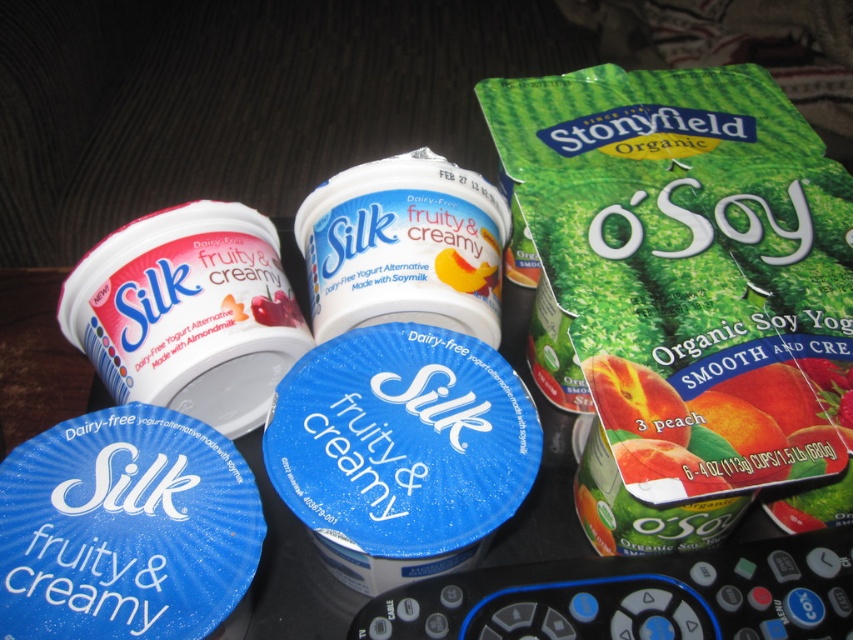
Question: Which point is closer to the camera?

Choices:
 (A) (354, 321)
 (B) (646, 429)
 (C) (94, 280)

Answer: (B)

Question: In this image, where is green matte pouch at upper right located relative to matte white yogurt at center?

Choices:
 (A) right
 (B) left

Answer: (A)

Question: Does green matte pouch at upper right appear on the right side of white matte yogurt at center?

Choices:
 (A) no
 (B) yes

Answer: (B)

Question: Which object is the closest to the green matte pouch at upper right?

Choices:
 (A) matte white yogurt at center
 (B) white matte yogurt at center

Answer: (B)

Question: Does matte white yogurt at center have a smaller size compared to white matte yogurt at center?

Choices:
 (A) yes
 (B) no

Answer: (B)

Question: Which point is closer to the camera taking this photo?

Choices:
 (A) (380, 269)
 (B) (286, 307)

Answer: (A)